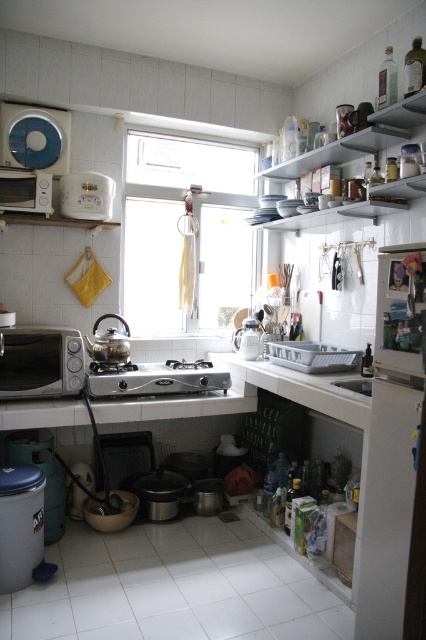
Question: Estimate the real-world distances between objects in this image. Which object is farther from the satin silver microwave at lower left?

Choices:
 (A) metallic silver dishes at upper right
 (B) matte white microwave at left

Answer: (A)

Question: Does transparent glass window at center appear under silver metallic stove at center?

Choices:
 (A) no
 (B) yes

Answer: (A)

Question: Which object appears farthest from the camera in this image?

Choices:
 (A) white glossy sink at lower center
 (B) metallic silver dishes at upper right
 (C) transparent glass window at center
 (D) silver metallic stove at center

Answer: (C)

Question: Does transparent glass window at center appear on the right side of white glossy sink at lower center?

Choices:
 (A) yes
 (B) no

Answer: (B)

Question: Which of the following is the farthest from the observer?

Choices:
 (A) (342, 384)
 (B) (14, 172)

Answer: (B)

Question: Can you confirm if silver metallic stove at center is positioned above white glossy sink at lower center?

Choices:
 (A) no
 (B) yes

Answer: (B)